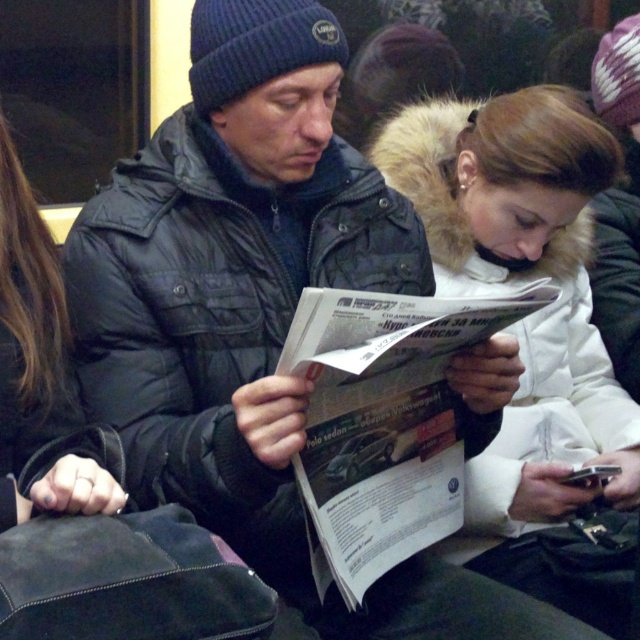
Looking at this image, can you confirm if white fur coat at center is thinner than black leather jacket at center?

No, white fur coat at center is not thinner than black leather jacket at center.

Who is higher up, white fur coat at center or black leather jacket at center?

Positioned higher is black leather jacket at center.

The width and height of the screenshot is (640, 640). I want to click on white fur coat at center, so click(525, 316).

This screenshot has width=640, height=640. I want to click on white fur coat at center, so click(525, 316).